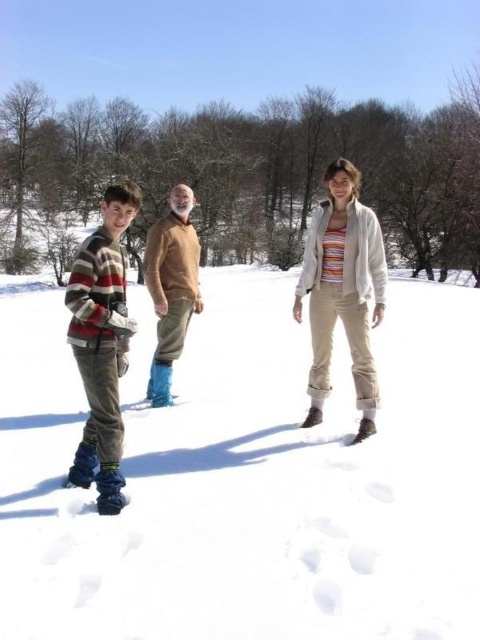
Question: Which point appears closest to the camera in this image?

Choices:
 (A) (364, 401)
 (B) (124, 324)
 (C) (192, 195)

Answer: (B)

Question: Which point is closer to the camera?

Choices:
 (A) (340, 253)
 (B) (92, 371)
 (C) (176, 202)

Answer: (B)

Question: Considering the relative positions of striped wool sweater at left and brown fuzzy sweater at center in the image provided, where is striped wool sweater at left located with respect to brown fuzzy sweater at center?

Choices:
 (A) left
 (B) right

Answer: (A)

Question: From the image, what is the correct spatial relationship of striped sweater at center in relation to striped wool sweater at left?

Choices:
 (A) left
 (B) right

Answer: (B)

Question: Is striped wool sweater at left to the left of brown fuzzy sweater at center from the viewer's perspective?

Choices:
 (A) no
 (B) yes

Answer: (B)

Question: Based on their relative distances, which object is farther from the striped sweater at center?

Choices:
 (A) brown fuzzy sweater at center
 (B) striped wool sweater at left

Answer: (B)